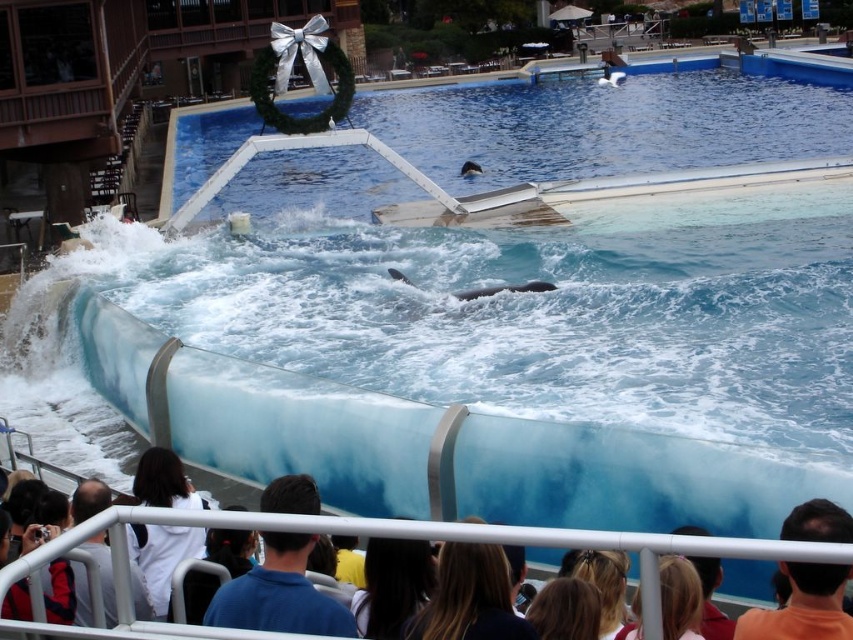
From the picture: You are a photographer standing at the edge of the pool. You want to capture a photo that emphasizes the blue glossy water at upper center and the gray matte dolphin at center. Based on their sizes in the image, which one should you focus on to ensure it takes up more space in your photo?

The blue glossy water at upper center is bigger than the gray matte dolphin at center, so focusing on the blue glossy water at upper center will ensure it takes up more space in the photo.

You are a photographer standing at the edge of the pool. You want to capture a photo of the gray matte dolphin at center and the blue glossy water at upper center. According to the scene, which object should you focus on first if you want to capture both in one shot?

The gray matte dolphin at center should be focused on first because the blue glossy water at upper center is to the right of it, so adjusting the camera to include both would require framing from the dolphin towards the right where the water is located.